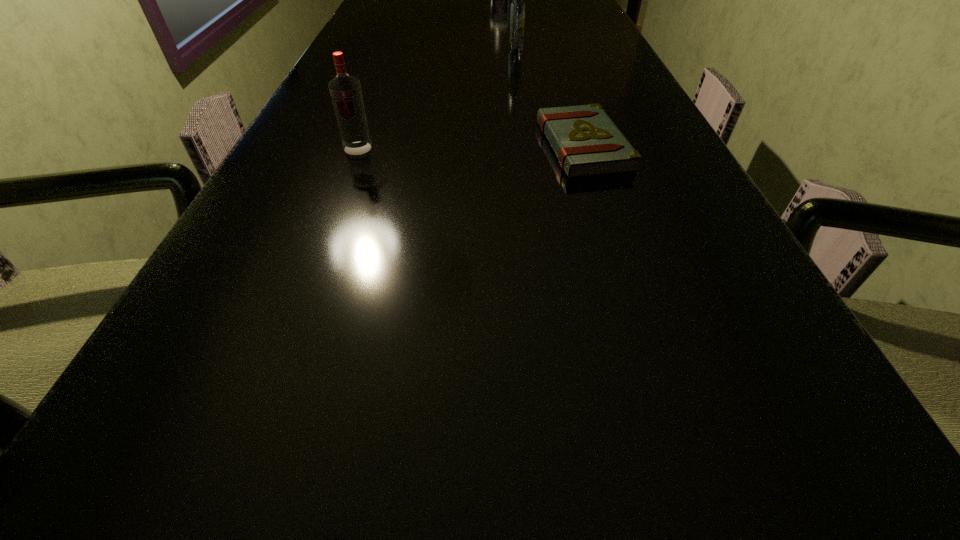
The width and height of the screenshot is (960, 540). What are the coordinates of `object that is at the right edge` in the screenshot? It's located at (587, 143).

Where is `free space at the near edge of the desktop`? free space at the near edge of the desktop is located at coordinates (681, 502).

Where is `vacant point at the left edge`? vacant point at the left edge is located at coordinates (367, 11).

Locate an element on the screen. This screenshot has height=540, width=960. vacant point at the right edge is located at coordinates (771, 370).

This screenshot has height=540, width=960. Find the location of `vacant space in between the rightmost object and the second object from left to right`. vacant space in between the rightmost object and the second object from left to right is located at coordinates (549, 99).

At what (x,y) coordinates should I click in order to perform the action: click on free space between the second object from left to right and the leftmost object. Please return your answer as a coordinate pair (x, y). This screenshot has height=540, width=960. Looking at the image, I should click on (437, 100).

The width and height of the screenshot is (960, 540). In order to click on vacant point located between the left vodka and the right vodka in this screenshot , I will do `click(437, 100)`.

The height and width of the screenshot is (540, 960). Find the location of `unoccupied position between the book and the left vodka`. unoccupied position between the book and the left vodka is located at coordinates (470, 147).

Identify the location of vacant region between the nearer vodka and the shortest object. Image resolution: width=960 pixels, height=540 pixels. (470, 147).

What are the coordinates of `object that is the closest to the leftmost object` in the screenshot? It's located at (587, 143).